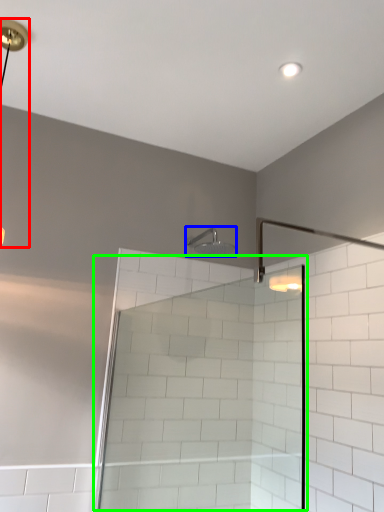
Question: Which is nearer to the lamp (highlighted by a red box)? shower (highlighted by a blue box) or screen door (highlighted by a green box).

Choices:
 (A) shower
 (B) screen door

Answer: (A)